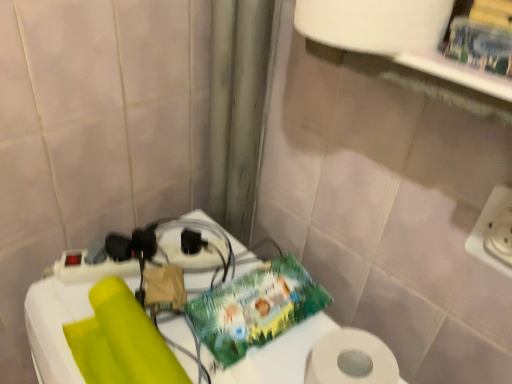
Locate an element on the screen. black plastic socket at center is located at coordinates (191, 242).

Describe the element at coordinates (191, 242) in the screenshot. I see `black plastic socket at center` at that location.

At what (x,y) coordinates should I click in order to perform the action: click on white plastic table at lower left. Please return your answer as a coordinate pair (x, y). This screenshot has width=512, height=384. Looking at the image, I should click on (54, 327).

Is white plastic electric outlet at right directly adjacent to white plastic table at lower left?

They are not placed beside each other.

Locate an element on the screen. electric outlet above the white plastic table at lower left (from a real-world perspective) is located at coordinates (494, 231).

From a real-world perspective, is white plastic electric outlet at right physically below white plastic table at lower left?

Actually, white plastic electric outlet at right is physically above white plastic table at lower left in the real world.

Does white plastic electric outlet at right lie in front of white plastic table at lower left?

No, the depth of white plastic electric outlet at right is greater than that of white plastic table at lower left.

Looking at this image, how different are the orientations of black plastic socket at center and white plastic table at lower left in degrees?

There is a 44.1-degree angle between the facing directions of black plastic socket at center and white plastic table at lower left.

Is black plastic socket at center facing towards white plastic table at lower left?

No, black plastic socket at center is not oriented towards white plastic table at lower left.

Identify the location of socket above the white plastic table at lower left (from a real-world perspective). Image resolution: width=512 pixels, height=384 pixels. pos(191,242).

Can you confirm if black plastic socket at center is bigger than white plastic table at lower left?

Incorrect, black plastic socket at center is not larger than white plastic table at lower left.

Considering the points (279, 372) and (488, 226), which point is in front, point (279, 372) or point (488, 226)?

The point (488, 226) is more forward.

From the image's perspective, which object appears higher, white plastic table at lower left or white plastic electric outlet at right?

white plastic electric outlet at right appears higher in the image.

In terms of height, does white plastic table at lower left look taller or shorter compared to white plastic electric outlet at right?

Considering their sizes, white plastic table at lower left has more height than white plastic electric outlet at right.

Between white plastic table at lower left and white plastic electric outlet at right, which one appears on the right side from the viewer's perspective?

white plastic electric outlet at right is more to the right.

Is white plastic electric outlet at right located outside black plastic socket at center?

Yes.

Is point (493, 228) positioned after point (190, 253)?

No, it is not.

Does white plastic electric outlet at right turn towards black plastic socket at center?

No, white plastic electric outlet at right is not oriented towards black plastic socket at center.

From a real-world perspective, is white plastic electric outlet at right over black plastic socket at center?

Correct, in the physical world, white plastic electric outlet at right is higher than black plastic socket at center.

Is black plastic socket at center positioned with its back to white plastic electric outlet at right?

black plastic socket at center is not turned away from white plastic electric outlet at right.

This screenshot has height=384, width=512. I want to click on electric outlet on the right of black plastic socket at center, so click(494, 231).

Measure the distance between black plastic socket at center and white plastic electric outlet at right.

black plastic socket at center and white plastic electric outlet at right are 19.54 inches apart.

How different are the orientations of black plastic socket at center and white plastic electric outlet at right in degrees?

black plastic socket at center and white plastic electric outlet at right are facing 42.8 degrees away from each other.

Looking at this image, can you confirm if white plastic table at lower left is positioned to the left of black plastic socket at center?

In fact, white plastic table at lower left is to the right of black plastic socket at center.

In terms of size, does white plastic table at lower left appear bigger or smaller than black plastic socket at center?

Clearly, white plastic table at lower left is larger in size than black plastic socket at center.

Is point (36, 318) positioned behind point (196, 251)?

No, (36, 318) is in front of (196, 251).

From the image's perspective, would you say white plastic table at lower left is shown under black plastic socket at center?

Yes, from the image's perspective, white plastic table at lower left is beneath black plastic socket at center.

At what (x,y) coordinates should I click in order to perform the action: click on table lying below the white plastic electric outlet at right (from the image's perspective). Please return your answer as a coordinate pair (x, y). Image resolution: width=512 pixels, height=384 pixels. Looking at the image, I should click on (54, 327).

Where is `table located in front of the black plastic socket at center`? The image size is (512, 384). table located in front of the black plastic socket at center is located at coordinates (54, 327).

Looking at the image, which one is located closer to white plastic table at lower left, black plastic socket at center or white plastic electric outlet at right?

black plastic socket at center.

Based on their spatial positions, is white plastic table at lower left or black plastic socket at center closer to white plastic electric outlet at right?

white plastic table at lower left is positioned closer to the anchor white plastic electric outlet at right.

When comparing their distances from black plastic socket at center, does white plastic electric outlet at right or white plastic table at lower left seem closer?

white plastic table at lower left.

Considering their positions, is white plastic electric outlet at right positioned closer to white plastic table at lower left than black plastic socket at center?

Based on the image, black plastic socket at center appears to be nearer to white plastic table at lower left.

In the scene shown: Looking at the image, which one is located closer to black plastic socket at center, white plastic table at lower left or white plastic electric outlet at right?

white plastic table at lower left is closer to black plastic socket at center.

Considering their positions, is black plastic socket at center positioned closer to white plastic electric outlet at right than white plastic table at lower left?

white plastic table at lower left is positioned closer to the anchor white plastic electric outlet at right.

Image resolution: width=512 pixels, height=384 pixels. I want to click on table between black plastic socket at center and white plastic electric outlet at right, so click(54, 327).